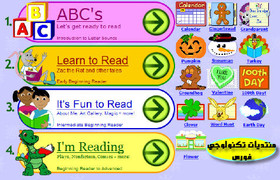
The width and height of the screenshot is (280, 180). What are the coordinates of `calendar` in the screenshot? It's located at (200, 5).